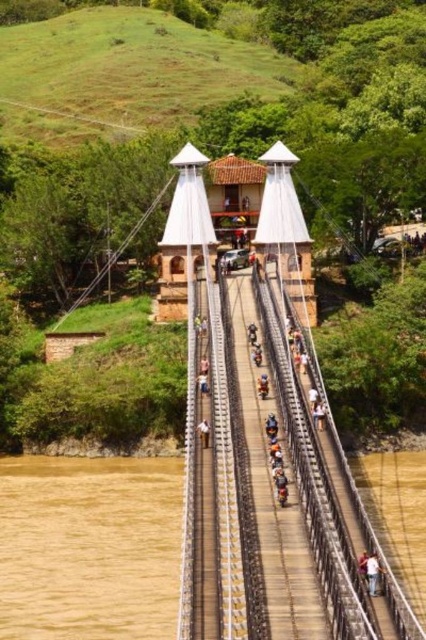
Question: Is brown muddy water at lower left to the left of white fabric person at center from the viewer's perspective?

Choices:
 (A) no
 (B) yes

Answer: (B)

Question: Considering the real-world distances, which object is farthest from the light brown wooden bridge at center?

Choices:
 (A) brown muddy water at lower left
 (B) white fabric person at center

Answer: (A)

Question: Among these objects, which one is nearest to the camera?

Choices:
 (A) white fabric person at center
 (B) brown muddy water at lower left
 (C) light brown wooden bridge at center

Answer: (C)

Question: Is brown muddy water at lower left below light brown wooden bridge at center?

Choices:
 (A) yes
 (B) no

Answer: (A)

Question: Which point appears closest to the camera in this image?

Choices:
 (A) (22, 577)
 (B) (209, 436)

Answer: (A)

Question: Is light brown wooden bridge at center bigger than white fabric person at center?

Choices:
 (A) yes
 (B) no

Answer: (A)